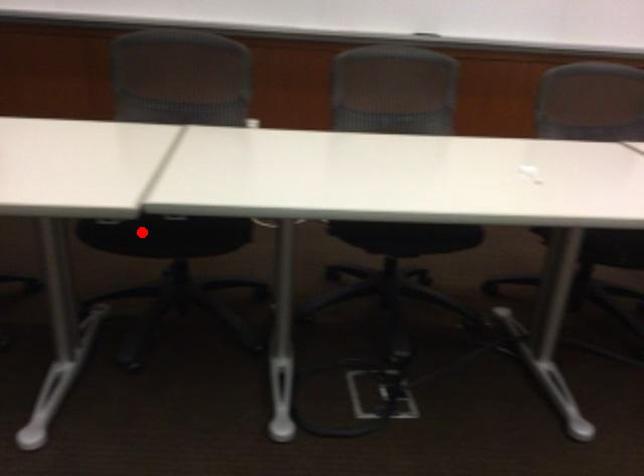
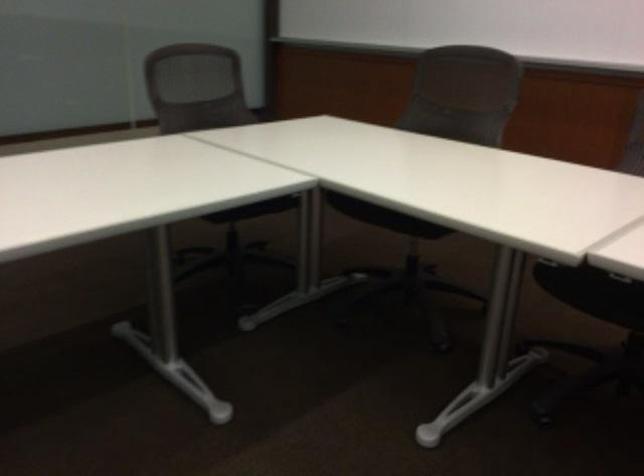
Question: A red point is marked in image1. In image2, is the corresponding 3D point closer to the camera or farther? Reply with the corresponding letter.

Choices:
 (A) The corresponding 3D point is closer.
 (B) The corresponding 3D point is farther.

Answer: (A)